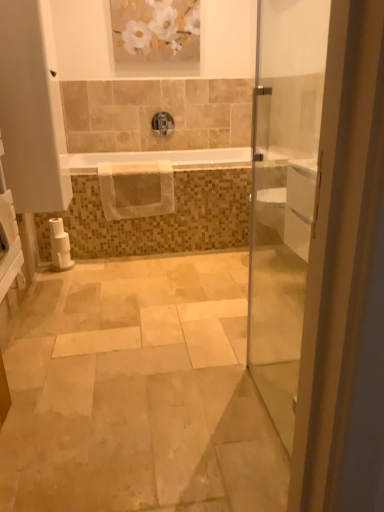
This screenshot has width=384, height=512. What are the coordinates of `white matte painting at upper center` in the screenshot? It's located at (156, 26).

What do you see at coordinates (136, 189) in the screenshot? Image resolution: width=384 pixels, height=512 pixels. I see `white textured hand towel at center` at bounding box center [136, 189].

This screenshot has height=512, width=384. What do you see at coordinates (284, 194) in the screenshot?
I see `white glossy door at right` at bounding box center [284, 194].

The height and width of the screenshot is (512, 384). What are the coordinates of `white glossy bathtub at center` in the screenshot? It's located at (160, 159).

This screenshot has width=384, height=512. What do you see at coordinates (160, 159) in the screenshot?
I see `white glossy bathtub at center` at bounding box center [160, 159].

Find the location of a particular element. The image size is (384, 512). white matte toilet paper at lower left is located at coordinates (59, 246).

Considering the sizes of objects satin nickel faucet at upper center and white glossy door at right in the image provided, who is shorter, satin nickel faucet at upper center or white glossy door at right?

satin nickel faucet at upper center is shorter.

At what (x,y) coordinates should I click in order to perform the action: click on door beneath the satin nickel faucet at upper center (from a real-world perspective). Please return your answer as a coordinate pair (x, y). Looking at the image, I should click on (284, 194).

Does point (166, 134) appear closer or farther from the camera than point (259, 373)?

Point (166, 134) is positioned farther from the camera compared to point (259, 373).

Is satin nickel faucet at upper center to the left or to the right of white glossy door at right in the image?

satin nickel faucet at upper center is positioned on white glossy door at right's left side.

Is white glossy bathtub at center at the back of white matte painting at upper center?

No, white matte painting at upper center is not facing the opposite direction of white glossy bathtub at center.

How many degrees apart are the facing directions of white matte painting at upper center and white glossy bathtub at center?

0.368 degrees.

Looking at this image, considering the positions of objects white matte painting at upper center and white glossy bathtub at center in the image provided, who is more to the left, white matte painting at upper center or white glossy bathtub at center?

white matte painting at upper center is more to the left.

Locate an element on the screen. This screenshot has height=512, width=384. bathtub located on the right of white matte painting at upper center is located at coordinates (160, 159).

Considering the sizes of objects white matte toilet paper at lower left and white matte painting at upper center in the image provided, who is thinner, white matte toilet paper at lower left or white matte painting at upper center?

With smaller width is white matte painting at upper center.

Are white matte toilet paper at lower left and white matte painting at upper center far apart?

Yes.

Which is closer to the camera, (51, 225) or (169, 49)?

The point (51, 225) is closer to the camera.

Is white matte toilet paper at lower left facing towards white matte painting at upper center?

No, white matte toilet paper at lower left does not turn towards white matte painting at upper center.

Who is more distant, white textured hand towel at center or white matte toilet paper at lower left?

white textured hand towel at center is further from the camera.

Considering the sizes of objects white textured hand towel at center and white matte toilet paper at lower left in the image provided, who is smaller, white textured hand towel at center or white matte toilet paper at lower left?

white matte toilet paper at lower left.

Which is in front, point (172, 192) or point (61, 263)?

Positioned in front is point (61, 263).

The image size is (384, 512). In the image, there is a white textured hand towel at center. Find the location of `toilet paper below it (from the image's perspective)`. toilet paper below it (from the image's perspective) is located at coordinates (59, 246).

Between satin nickel faucet at upper center and white textured hand towel at center, which one has larger width?

Wider between the two is white textured hand towel at center.

From the image's perspective, between satin nickel faucet at upper center and white textured hand towel at center, which one is located above?

satin nickel faucet at upper center.

Is satin nickel faucet at upper center taller than white textured hand towel at center?

In fact, satin nickel faucet at upper center may be shorter than white textured hand towel at center.

Is satin nickel faucet at upper center aimed at white textured hand towel at center?

Yes.

Who is taller, white glossy door at right or white glossy bathtub at center?

white glossy door at right.

Visually, is white glossy door at right positioned to the left or to the right of white glossy bathtub at center?

Based on their positions, white glossy door at right is located to the right of white glossy bathtub at center.

Is point (308, 164) closer to viewer compared to point (66, 162)?

Yes, point (308, 164) is closer to viewer.

Does satin nickel faucet at upper center turn towards white matte painting at upper center?

No, satin nickel faucet at upper center is not turned towards white matte painting at upper center.

From the image's perspective, between satin nickel faucet at upper center and white matte painting at upper center, who is located below?

satin nickel faucet at upper center, from the image's perspective.

In terms of width, does satin nickel faucet at upper center look wider or thinner when compared to white matte painting at upper center?

satin nickel faucet at upper center is wider than white matte painting at upper center.

Between satin nickel faucet at upper center and white matte painting at upper center, which one has smaller size?

satin nickel faucet at upper center is smaller.

Locate an element on the screen. This screenshot has height=512, width=384. door that appears on the right of satin nickel faucet at upper center is located at coordinates (284, 194).

Identify the location of flower located on the left of white glossy bathtub at center. Image resolution: width=384 pixels, height=512 pixels. (156, 26).

Looking at this image, based on their spatial positions, is white matte painting at upper center or white glossy bathtub at center closer to satin nickel faucet at upper center?

Among the two, white matte painting at upper center is located nearer to satin nickel faucet at upper center.

Looking at the image, which one is located closer to satin nickel faucet at upper center, white glossy bathtub at center or white glossy door at right?

white glossy bathtub at center is positioned closer to the anchor satin nickel faucet at upper center.

Consider the image. Estimate the real-world distances between objects in this image. Which object is closer to white matte toilet paper at lower left, white matte painting at upper center or white glossy bathtub at center?

white glossy bathtub at center.

When comparing their distances from satin nickel faucet at upper center, does white textured hand towel at center or white matte painting at upper center seem further?

white textured hand towel at center is positioned further to the anchor satin nickel faucet at upper center.

Estimate the real-world distances between objects in this image. Which object is further from white textured hand towel at center, satin nickel faucet at upper center or white glossy bathtub at center?

The object further to white textured hand towel at center is satin nickel faucet at upper center.

Based on their spatial positions, is satin nickel faucet at upper center or white glossy bathtub at center closer to white matte toilet paper at lower left?

white glossy bathtub at center lies closer to white matte toilet paper at lower left than the other object.

From the image, which object appears to be farther from satin nickel faucet at upper center, white matte toilet paper at lower left or white textured hand towel at center?

white matte toilet paper at lower left lies further to satin nickel faucet at upper center than the other object.

Which object lies nearer to the anchor point white matte toilet paper at lower left, white glossy door at right or white matte painting at upper center?

Among the two, white matte painting at upper center is located nearer to white matte toilet paper at lower left.

Locate an element on the screen. tap that lies between white matte painting at upper center and white glossy bathtub at center from top to bottom is located at coordinates (163, 123).

At what (x,y) coordinates should I click in order to perform the action: click on flower located between white glossy door at right and satin nickel faucet at upper center in the depth direction. Please return your answer as a coordinate pair (x, y). Looking at the image, I should click on (156, 26).

You are a GUI agent. You are given a task and a screenshot of the screen. Output one action in this format:
    pyautogui.click(x=<x>, y=<y>)
    Task: Click on the toilet paper between white glossy door at right and white glossy bathtub at center in the front-back direction
    The height and width of the screenshot is (512, 384).
    Given the screenshot: What is the action you would take?
    pyautogui.click(x=59, y=246)

At what (x,y) coordinates should I click in order to perform the action: click on bathtub between white glossy door at right and satin nickel faucet at upper center in the front-back direction. Please return your answer as a coordinate pair (x, y). The width and height of the screenshot is (384, 512). Looking at the image, I should click on (160, 159).